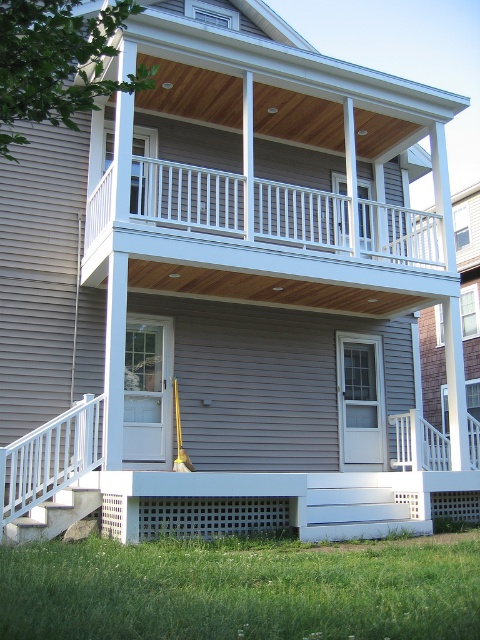
How much distance is there between white matte railing at lower left and white painted wood stairs at lower left?

white matte railing at lower left is 18.02 inches away from white painted wood stairs at lower left.

The height and width of the screenshot is (640, 480). I want to click on white matte railing at lower left, so click(x=49, y=458).